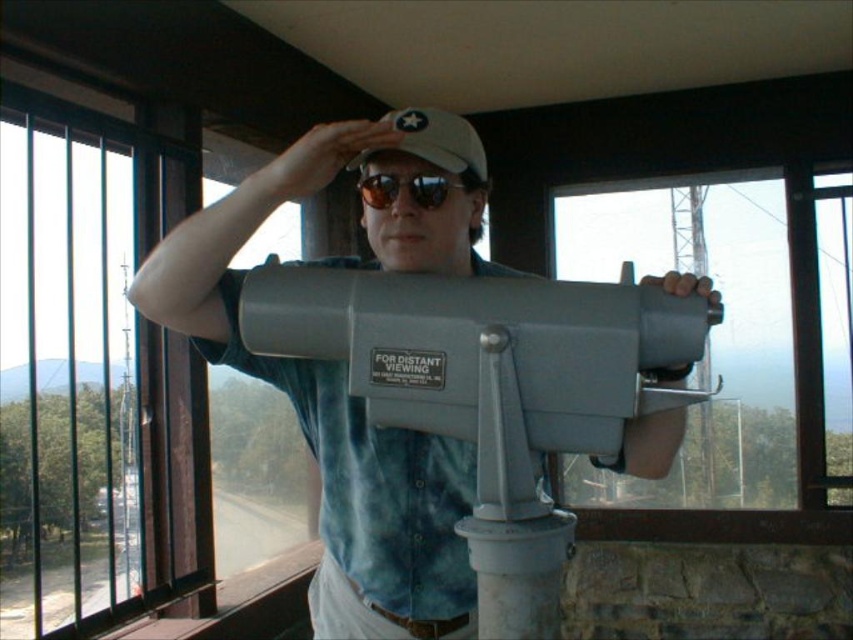
You are a tour guide explaining the layout of the observation deck to a visitor. The visitor asks, which object is located above the other between the matte gray telescope at center and the white matte baseball hat at center? Please explain using the scene details.

The white matte baseball hat at center is above the matte gray telescope at center because the telescope is positioned under the hat according to the scene description.

You are a visitor at the observation deck and want to take a photo of the scenic view outside through the clear glass window at left. However, you notice the matte gray telescope at center is blocking part of the window. Can you estimate if the entire window can be framed without moving the telescope?

The clear glass window at left is wider than the matte gray telescope at center. Since the window is wider, you can frame the entire window in your photo without moving the telescope as it does not fully block the window.

You are a tour guide explaining the equipment to a visitor. The visitor asks if the matte gray telescope at center is taller than their sunglasses at center. How do you respond?

Yes, the matte gray telescope at center is taller than the sunglasses at center.